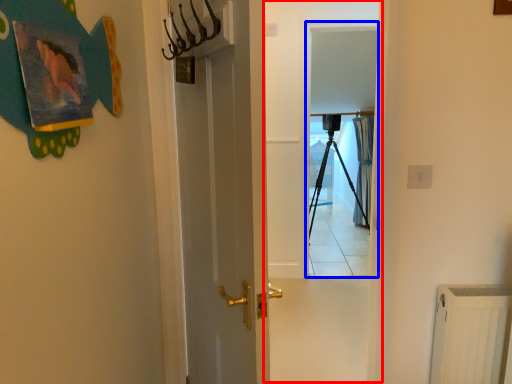
Question: Which object appears closest to the camera in this image, screen door (highlighted by a red box) or screen door (highlighted by a blue box)?

Choices:
 (A) screen door
 (B) screen door

Answer: (A)